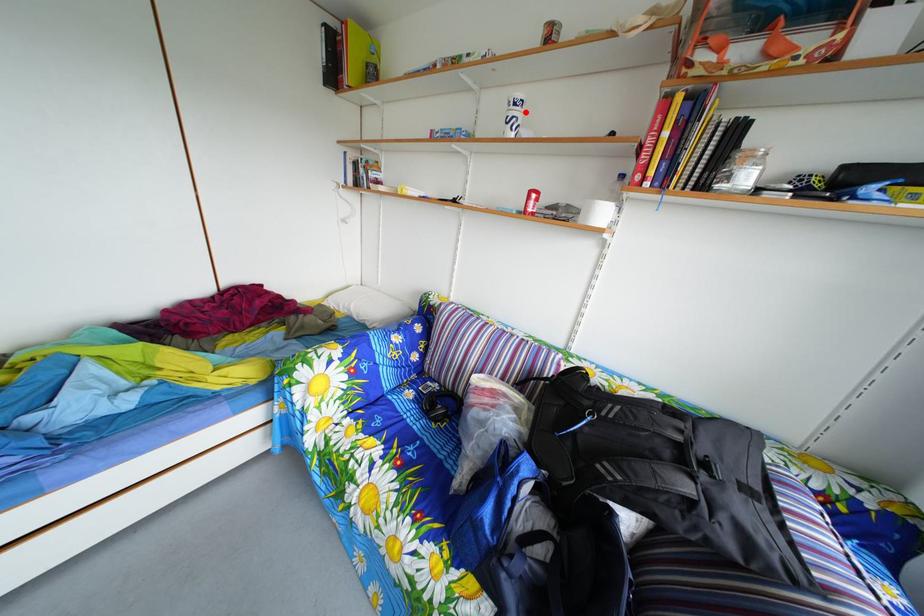
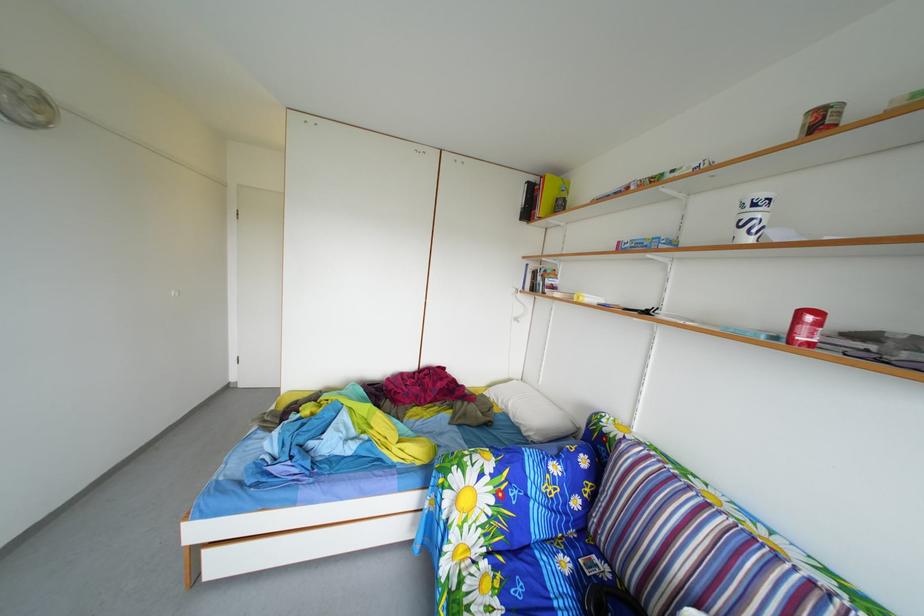
Locate, in the second image, the point that corresponds to the highlighted location in the first image.

(766, 214)